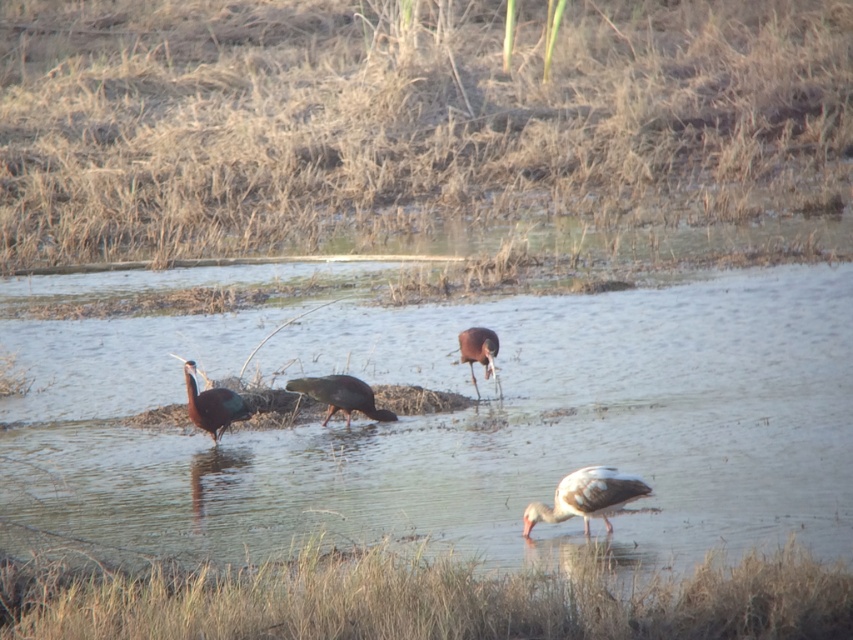
You are standing at the camera position and want to reach the point marked at coordinates (815, 358) in the image. The path to this point is 13 meters long. Can you walk directly to it without needing to detour?

The point at coordinates (815, 358) is 12.55 meters away from the camera. Since the path is 13 meters long, which is slightly longer than the straight distance, you can walk directly to it without needing to detour.

You are a birdwatcher observing the scene. You notice the clear water at center and the white matte bird at lower right. Which object is located above the other?

The clear water at center is positioned over white matte bird at lower right, meaning the water is above the bird.

You are a photographer trying to capture the entire scene in one shot. Given that your camera can only focus on objects within a specific width, which object between the brown grass at upper center and the clear water at center should you prioritize to ensure it fits within the frame?

The brown grass at upper center has a larger width than the clear water at center, so you should prioritize capturing the brown grass at upper center to ensure it fits within the frame.